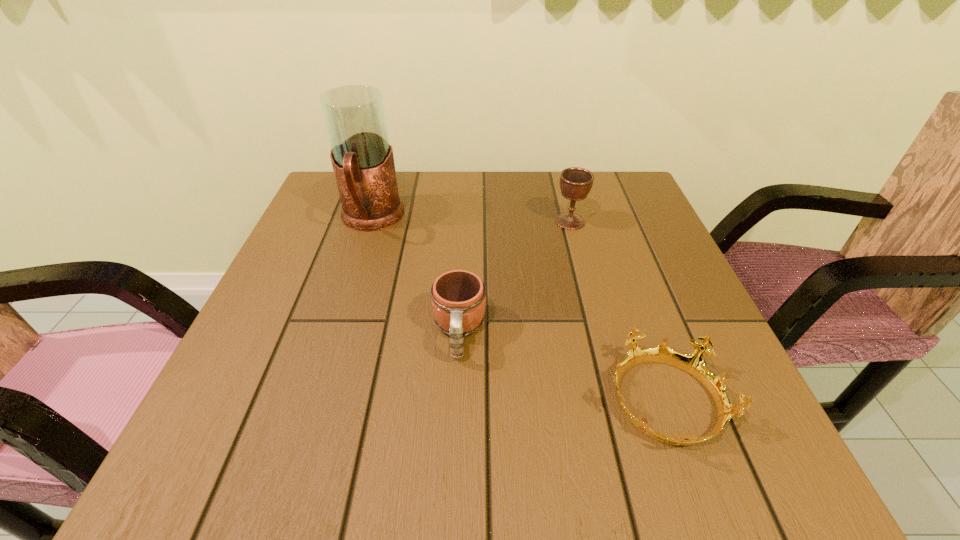
The width and height of the screenshot is (960, 540). Find the location of `free spot between the chalice and the pitcher`. free spot between the chalice and the pitcher is located at coordinates (470, 220).

Identify the location of free space between the third object from right to left and the shortest object. Image resolution: width=960 pixels, height=540 pixels. pyautogui.click(x=562, y=368).

Image resolution: width=960 pixels, height=540 pixels. I want to click on vacant area that lies between the third shortest object and the tallest object, so click(470, 220).

Identify the location of the third closest object relative to the crown. (363, 163).

Select which object appears as the second closest to the second tallest object. Please provide its 2D coordinates. Your answer should be formatted as a tuple, i.e. [(x, y)], where the tuple contains the x and y coordinates of a point satisfying the conditions above.

[(692, 363)]

You are a GUI agent. You are given a task and a screenshot of the screen. Output one action in this format:
    pyautogui.click(x=<x>, y=<y>)
    Task: Click on the free space that satisfies the following two spatial constraints: 1. with the handle on the side of the tallest object; 2. on the right side of the second tallest object
    The height and width of the screenshot is (540, 960).
    Given the screenshot: What is the action you would take?
    pyautogui.click(x=371, y=221)

Locate an element on the screen. free spot that satisfies the following two spatial constraints: 1. with the handle on the side of the shortest object; 2. on the left side of the tallest object is located at coordinates (313, 402).